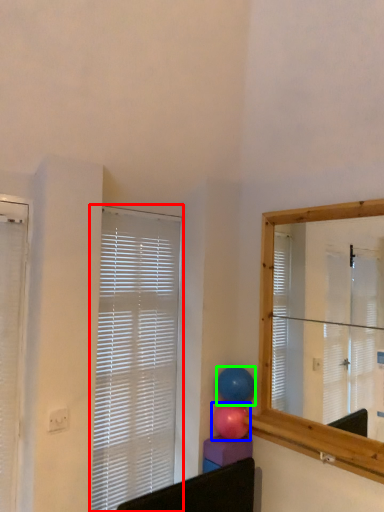
Question: Based on their relative distances, which object is nearer to window blind (highlighted by a red box)? Choose from balloon (highlighted by a blue box) and balloon (highlighted by a green box).

Choices:
 (A) balloon
 (B) balloon

Answer: (B)